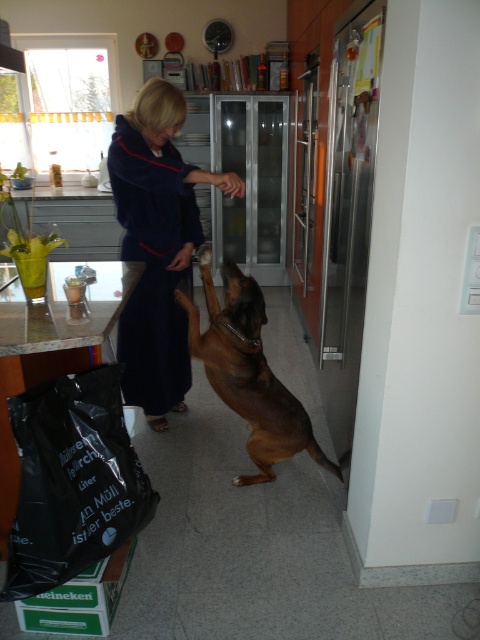
Is velvet-like navy blue robe at center further to camera compared to stainless steel refrigerator at right?

Yes, velvet-like navy blue robe at center is behind stainless steel refrigerator at right.

Who is positioned more to the left, velvet-like navy blue robe at center or stainless steel refrigerator at right?

velvet-like navy blue robe at center is more to the left.

In order to click on velvet-like navy blue robe at center in this screenshot , I will do `click(156, 244)`.

Based on the photo, does stainless steel refrigerator at right appear on the right side of brown shiny dog at center?

Correct, you'll find stainless steel refrigerator at right to the right of brown shiny dog at center.

Identify the location of stainless steel refrigerator at right. The width and height of the screenshot is (480, 640). (348, 211).

Who is taller, velvet-like navy blue robe at center or brown shiny dog at center?

velvet-like navy blue robe at center is taller.

Is velvet-like navy blue robe at center shorter than brown shiny dog at center?

No.

This screenshot has height=640, width=480. Identify the location of velvet-like navy blue robe at center. (156, 244).